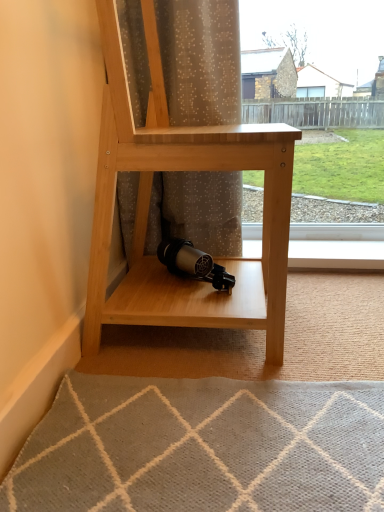
This screenshot has height=512, width=384. In order to click on natural wood shelf at center in this screenshot , I will do `click(149, 201)`.

This screenshot has width=384, height=512. Describe the element at coordinates (149, 201) in the screenshot. I see `natural wood shelf at center` at that location.

What is the approximate height of translucent fabric curtain at center?

It is 28.15 inches.

What do you see at coordinates (200, 60) in the screenshot? This screenshot has width=384, height=512. I see `translucent fabric curtain at center` at bounding box center [200, 60].

Identify the location of translucent fabric curtain at center. The width and height of the screenshot is (384, 512). (200, 60).

Locate an element on the screen. natural wood shelf at center is located at coordinates (149, 201).

Considering the positions of objects natural wood shelf at center and translucent fabric curtain at center in the image provided, who is more to the left, natural wood shelf at center or translucent fabric curtain at center?

translucent fabric curtain at center is more to the left.

Is the depth of natural wood shelf at center greater than that of translucent fabric curtain at center?

No, it is not.

Based on the photo, which is nearer, (x=98, y=217) or (x=206, y=193)?

Point (x=98, y=217) is closer to the camera than point (x=206, y=193).

From the image's perspective, is natural wood shelf at center on top of translucent fabric curtain at center?

No, from the image's perspective, natural wood shelf at center is not on top of translucent fabric curtain at center.

From a real-world perspective, is natural wood shelf at center positioned above or below translucent fabric curtain at center?

In terms of real-world spatial position, natural wood shelf at center is below translucent fabric curtain at center.

Is natural wood shelf at center thinner than translucent fabric curtain at center?

In fact, natural wood shelf at center might be wider than translucent fabric curtain at center.

Considering the sizes of objects natural wood shelf at center and translucent fabric curtain at center in the image provided, who is shorter, natural wood shelf at center or translucent fabric curtain at center?

translucent fabric curtain at center is shorter.

From the picture: Considering the sizes of natural wood shelf at center and translucent fabric curtain at center in the image, is natural wood shelf at center bigger or smaller than translucent fabric curtain at center?

Considering their sizes, natural wood shelf at center takes up more space than translucent fabric curtain at center.

Choose the correct answer: Is natural wood shelf at center inside translucent fabric curtain at center or outside it?

natural wood shelf at center is not inside translucent fabric curtain at center, it's outside.

Is there a large distance between natural wood shelf at center and translucent fabric curtain at center?

No, natural wood shelf at center is in close proximity to translucent fabric curtain at center.

Is natural wood shelf at center facing away from translucent fabric curtain at center?

No, natural wood shelf at center is not facing the opposite direction of translucent fabric curtain at center.

This screenshot has height=512, width=384. I want to click on shelf lying in front of the translucent fabric curtain at center, so [149, 201].

Between translucent fabric curtain at center and natural wood shelf at center, which one appears on the left side from the viewer's perspective?

translucent fabric curtain at center is more to the left.

Considering the relative positions of translucent fabric curtain at center and natural wood shelf at center in the image provided, is translucent fabric curtain at center in front of natural wood shelf at center?

No.

Does point (231, 40) come in front of point (113, 0)?

That is False.

From the image's perspective, between translucent fabric curtain at center and natural wood shelf at center, which one is located above?

translucent fabric curtain at center is shown above in the image.

From a real-world perspective, between translucent fabric curtain at center and natural wood shelf at center, who is vertically higher?

From a 3D spatial view, translucent fabric curtain at center is above.

In terms of width, does translucent fabric curtain at center look wider or thinner when compared to natural wood shelf at center?

Clearly, translucent fabric curtain at center has less width compared to natural wood shelf at center.

Based on the photo, which of these two, translucent fabric curtain at center or natural wood shelf at center, stands taller?

With more height is natural wood shelf at center.

Who is bigger, translucent fabric curtain at center or natural wood shelf at center?

natural wood shelf at center.

Is natural wood shelf at center completely or partially inside translucent fabric curtain at center?

No, translucent fabric curtain at center does not contain natural wood shelf at center.

Are translucent fabric curtain at center and natural wood shelf at center beside each other?

They are not placed beside each other.

Is natural wood shelf at center at the back of translucent fabric curtain at center?

Absolutely, translucent fabric curtain at center is directed away from natural wood shelf at center.

In the image, there is a translucent fabric curtain at center. At what (x,y) coordinates should I click in order to perform the action: click on shelf below it (from the image's perspective). Please return your answer as a coordinate pair (x, y). This screenshot has width=384, height=512. Looking at the image, I should click on (149, 201).

Where is `shelf located below the translucent fabric curtain at center (from the image's perspective)`? The image size is (384, 512). shelf located below the translucent fabric curtain at center (from the image's perspective) is located at coordinates (149, 201).

Find the location of `shelf below the translucent fabric curtain at center (from a real-world perspective)`. shelf below the translucent fabric curtain at center (from a real-world perspective) is located at coordinates (149, 201).